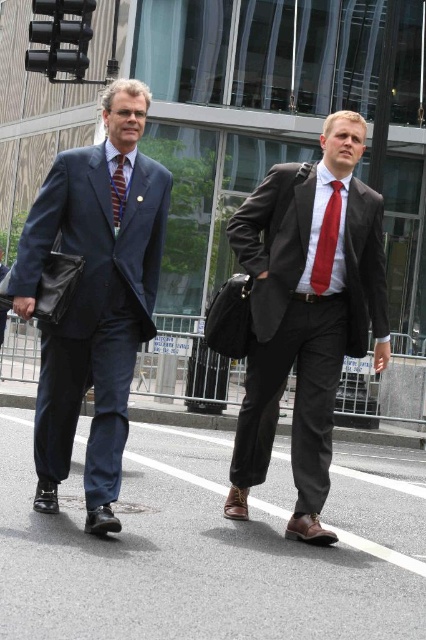
Does matte black suit at center appear on the left side of striped silk tie at center?

In fact, matte black suit at center is to the right of striped silk tie at center.

Does matte black suit at center come behind striped silk tie at center?

That is False.

Locate an element on the screen. This screenshot has height=640, width=426. matte black suit at center is located at coordinates (307, 310).

Does point (97, 444) lie behind point (118, 188)?

That is False.

Can you confirm if matte navy suit at left is positioned to the right of striped silk tie at center?

In fact, matte navy suit at left is to the left of striped silk tie at center.

I want to click on matte navy suit at left, so click(94, 300).

In the scene shown: Does matte black suit at center have a larger size compared to matte navy suit at left?

Actually, matte black suit at center might be smaller than matte navy suit at left.

The height and width of the screenshot is (640, 426). Find the location of `matte black suit at center`. matte black suit at center is located at coordinates (307, 310).

Does point (328, 120) lie in front of point (83, 387)?

No, it is behind (83, 387).

Locate an element on the screen. The height and width of the screenshot is (640, 426). matte black suit at center is located at coordinates (307, 310).